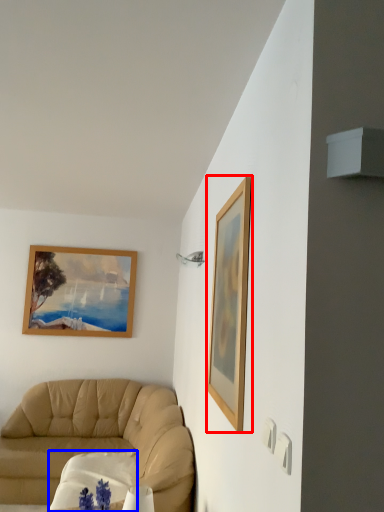
Question: Which point is closer to the camera, picture frame (highlighted by a red box) or round table (highlighted by a blue box)?

Choices:
 (A) picture frame
 (B) round table

Answer: (A)